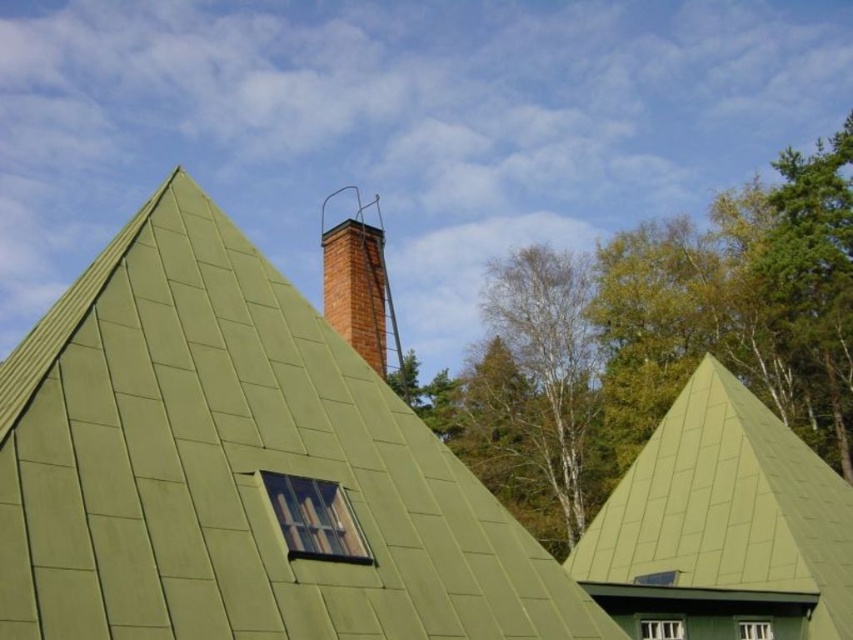
You are standing in front of the building with the green metal roof and want to locate two specific points marked on the structure. The first point is at coordinates point (x=28, y=420) and the second is at point (x=300, y=524). Which of these two points is closer to you as you face the building?

Point (x=28, y=420) is in front of point (x=300, y=524), so it is closer to you as you face the building.